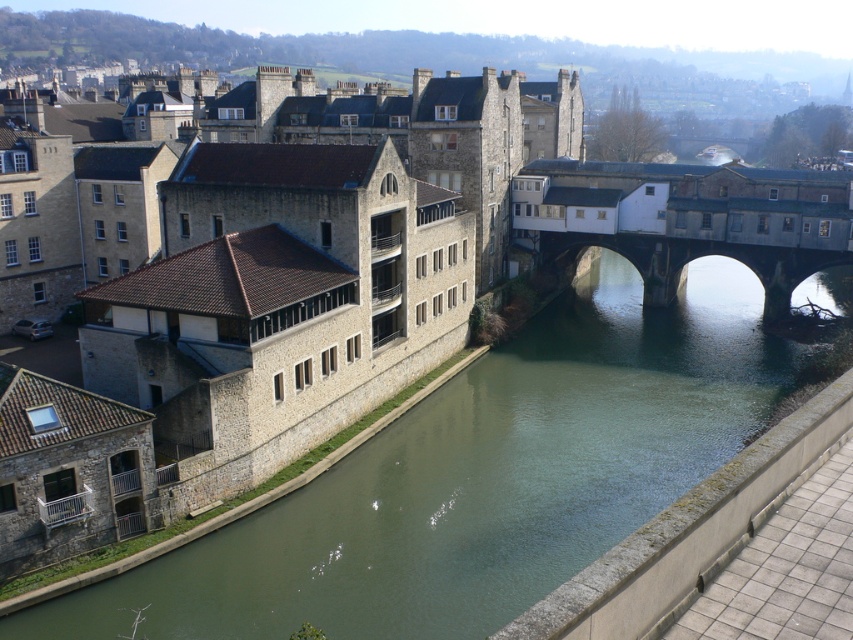
Question: Is stone building at center below stone arch bridge at center?

Choices:
 (A) no
 (B) yes

Answer: (A)

Question: Estimate the real-world distances between objects in this image. Which object is closer to the stone arch bridge at center?

Choices:
 (A) stone building at center
 (B) green stone river at center

Answer: (B)

Question: Which object is farther from the camera taking this photo?

Choices:
 (A) stone arch bridge at center
 (B) green stone river at center

Answer: (A)

Question: Is stone building at center above stone arch bridge at center?

Choices:
 (A) yes
 (B) no

Answer: (A)

Question: Where is stone building at center located in relation to stone arch bridge at center in the image?

Choices:
 (A) right
 (B) left

Answer: (B)

Question: Which is farther from the green stone river at center?

Choices:
 (A) stone arch bridge at center
 (B) stone building at center

Answer: (B)